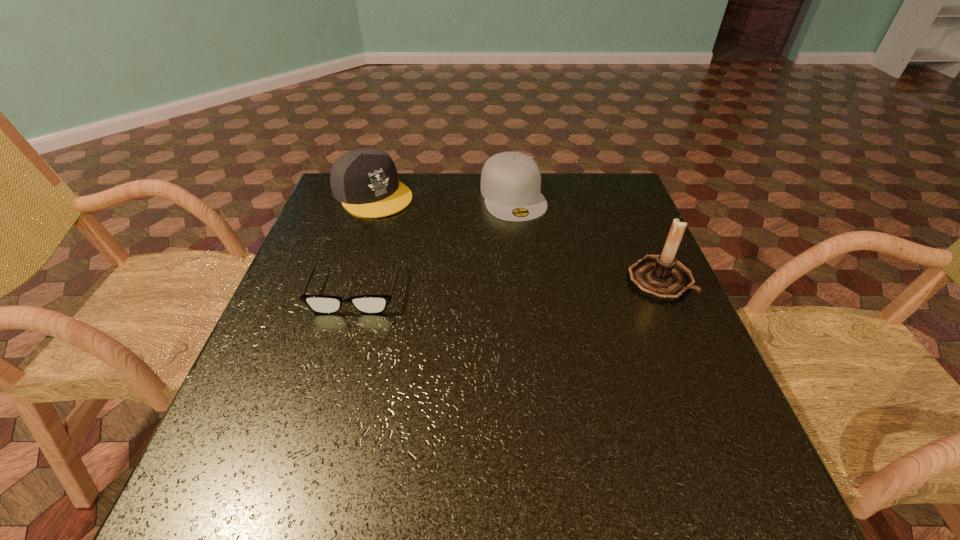
Identify the location of vacant space on the desktop that is between the spectacles and the tallest object and is positioned on the front-facing side of the second object from right to left. The image size is (960, 540). (552, 284).

At what (x,y) coordinates should I click in order to perform the action: click on vacant space on the desktop that is between the spectacles and the candle holder and is positioned on the front-facing side of the left cap. Please return your answer as a coordinate pair (x, y). Looking at the image, I should click on (483, 286).